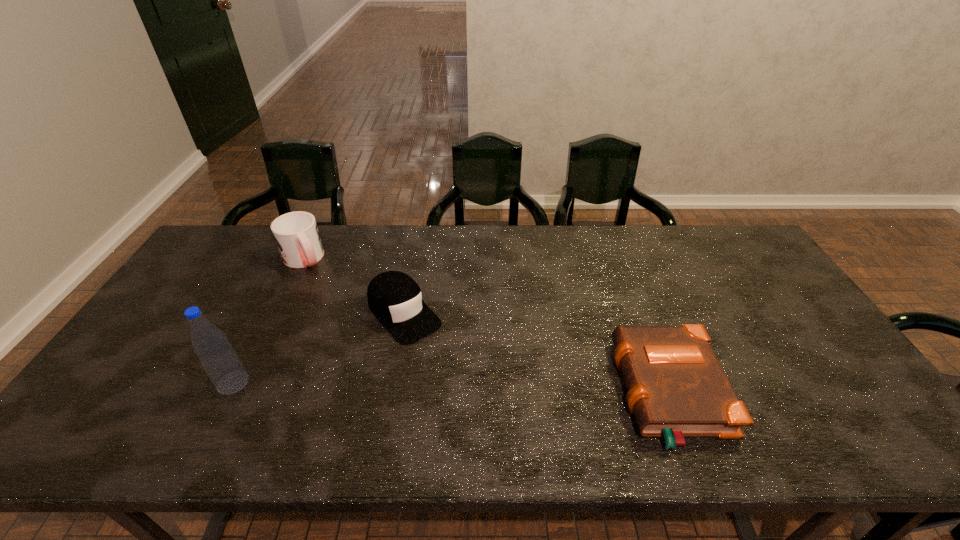
Where is `water bottle`? This screenshot has width=960, height=540. water bottle is located at coordinates (220, 361).

Where is `the rightmost object`? The image size is (960, 540). the rightmost object is located at coordinates (676, 386).

Locate an element on the screen. Image resolution: width=960 pixels, height=540 pixels. the shortest object is located at coordinates (676, 386).

I want to click on the second tallest object, so click(x=296, y=234).

Locate an element on the screen. The width and height of the screenshot is (960, 540). mug is located at coordinates (296, 234).

Where is `the second object from right to left`? This screenshot has width=960, height=540. the second object from right to left is located at coordinates (395, 299).

Locate an element on the screen. This screenshot has height=540, width=960. the third tallest object is located at coordinates (395, 299).

Locate an element on the screen. Image resolution: width=960 pixels, height=540 pixels. vacant space located on the back of the tallest object is located at coordinates (252, 343).

Identify the location of free spot located on the spine side of the shortest object. This screenshot has height=540, width=960. pos(505,393).

Identify the location of vacant area situated on the spine side of the shortest object. (501, 393).